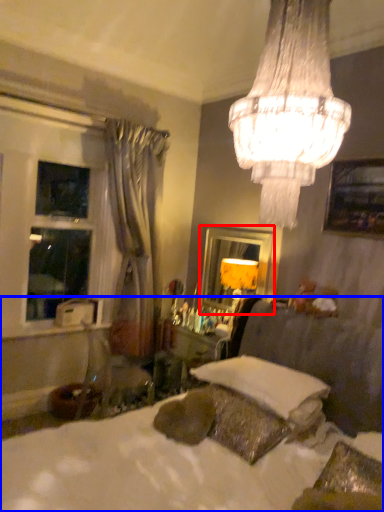
Question: Which object appears farthest to the camera in this image, mirror (highlighted by a red box) or bed (highlighted by a blue box)?

Choices:
 (A) mirror
 (B) bed

Answer: (A)